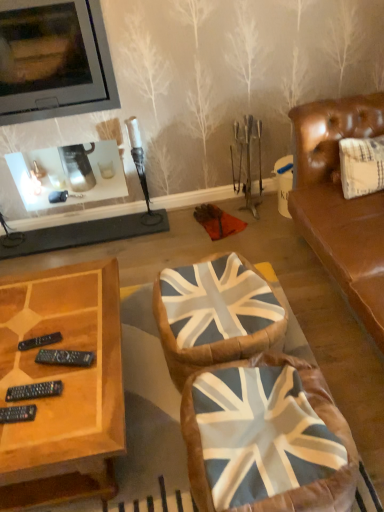
Measure the distance between union jack fabric swivel chair at center, which appears as the 2th swivel chair when viewed from the back, and camera.

The depth of union jack fabric swivel chair at center, which appears as the 2th swivel chair when viewed from the back, is 3.53 feet.

Describe the element at coordinates (54, 60) in the screenshot. I see `matte black television at upper left` at that location.

What are the coordinates of `union jack fabric swivel chair at center, which appears as the 2th swivel chair when viewed from the back` in the screenshot? It's located at (265, 438).

Which of these two, woodenwoodencoffee table at lower left or union jack fabric swivel chair at center, the second swivel chair when ordered from front to back, stands taller?

With more height is woodenwoodencoffee table at lower left.

Is woodenwoodencoffee table at lower left next to union jack fabric swivel chair at center, the 1th swivel chair when ordered from back to front, and touching it?

No, woodenwoodencoffee table at lower left is not with union jack fabric swivel chair at center, the 1th swivel chair when ordered from back to front.

Locate an element on the screen. This screenshot has height=512, width=384. coffee table that appears below the union jack fabric swivel chair at center, the second swivel chair when ordered from front to back (from the image's perspective) is located at coordinates (64, 386).

Is woodenwoodencoffee table at lower left smaller than union jack fabric swivel chair at center, the second swivel chair when ordered from front to back?

Actually, woodenwoodencoffee table at lower left might be larger than union jack fabric swivel chair at center, the second swivel chair when ordered from front to back.

From the image's perspective, is union jack fabric swivel chair at center, the 1th swivel chair when ordered from back to front, beneath union jack fabric swivel chair at center, the 1th swivel chair positioned from the front?

Incorrect, from the image's perspective, union jack fabric swivel chair at center, the 1th swivel chair when ordered from back to front, is higher than union jack fabric swivel chair at center, the 1th swivel chair positioned from the front.

Measure the distance between union jack fabric swivel chair at center, the second swivel chair when ordered from front to back, and union jack fabric swivel chair at center, which appears as the 2th swivel chair when viewed from the back.

union jack fabric swivel chair at center, the second swivel chair when ordered from front to back, is 9.74 inches away from union jack fabric swivel chair at center, which appears as the 2th swivel chair when viewed from the back.

Are union jack fabric swivel chair at center, the second swivel chair when ordered from front to back, and union jack fabric swivel chair at center, the 1th swivel chair positioned from the front, far apart?

No.

Considering the relative sizes of union jack fabric swivel chair at center, the second swivel chair when ordered from front to back, and matte black television at upper left in the image provided, is union jack fabric swivel chair at center, the second swivel chair when ordered from front to back, thinner than matte black television at upper left?

No.

Is union jack fabric swivel chair at center, the 1th swivel chair when ordered from back to front, directly adjacent to matte black television at upper left?

No, union jack fabric swivel chair at center, the 1th swivel chair when ordered from back to front, is not with matte black television at upper left.

Considering the relative sizes of union jack fabric swivel chair at center, the second swivel chair when ordered from front to back, and matte black television at upper left in the image provided, is union jack fabric swivel chair at center, the second swivel chair when ordered from front to back, bigger than matte black television at upper left?

Actually, union jack fabric swivel chair at center, the second swivel chair when ordered from front to back, might be smaller than matte black television at upper left.

From the image's perspective, is union jack fabric swivel chair at center, the second swivel chair when ordered from front to back, beneath matte black television at upper left?

Indeed, from the image's perspective, union jack fabric swivel chair at center, the second swivel chair when ordered from front to back, is shown beneath matte black television at upper left.

Which object is closer to the camera, woodenwoodencoffee table at lower left or union jack fabric swivel chair at center, which appears as the 2th swivel chair when viewed from the back?

union jack fabric swivel chair at center, which appears as the 2th swivel chair when viewed from the back.

Measure the distance from woodenwoodencoffee table at lower left to union jack fabric swivel chair at center, which appears as the 2th swivel chair when viewed from the back.

woodenwoodencoffee table at lower left and union jack fabric swivel chair at center, which appears as the 2th swivel chair when viewed from the back, are 17.87 inches apart from each other.

Is woodenwoodencoffee table at lower left to the left of union jack fabric swivel chair at center, which appears as the 2th swivel chair when viewed from the back, from the viewer's perspective?

Indeed, woodenwoodencoffee table at lower left is positioned on the left side of union jack fabric swivel chair at center, which appears as the 2th swivel chair when viewed from the back.

Considering the positions of points (88, 463) and (249, 389), is point (88, 463) farther from camera compared to point (249, 389)?

No, it is in front of (249, 389).

Considering the points (17, 47) and (319, 407), which point is in front, point (17, 47) or point (319, 407)?

The point (319, 407) is closer.

You are a GUI agent. You are given a task and a screenshot of the screen. Output one action in this format:
    pyautogui.click(x=<x>, y=<y>)
    Task: Click on the swivel chair that is the 2nd one when counting forward from the matte black television at upper left
    The width and height of the screenshot is (384, 512).
    Given the screenshot: What is the action you would take?
    pyautogui.click(x=265, y=438)

Who is more distant, matte black television at upper left or union jack fabric swivel chair at center, the 1th swivel chair positioned from the front?

Positioned behind is matte black television at upper left.

From a real-world perspective, between matte black television at upper left and union jack fabric swivel chair at center, the 1th swivel chair positioned from the front, who is vertically lower?

In real-world perspective, union jack fabric swivel chair at center, the 1th swivel chair positioned from the front, is lower.

Considering the sizes of union jack fabric swivel chair at center, the 1th swivel chair when ordered from back to front, and woodenwoodencoffee table at lower left in the image, is union jack fabric swivel chair at center, the 1th swivel chair when ordered from back to front, wider or thinner than woodenwoodencoffee table at lower left?

union jack fabric swivel chair at center, the 1th swivel chair when ordered from back to front, is thinner than woodenwoodencoffee table at lower left.

How distant is union jack fabric swivel chair at center, the second swivel chair when ordered from front to back, from woodenwoodencoffee table at lower left?

15.20 inches.

You are a GUI agent. You are given a task and a screenshot of the screen. Output one action in this format:
    pyautogui.click(x=<x>, y=<y>)
    Task: Click on the coffee table above the union jack fabric swivel chair at center, the second swivel chair when ordered from front to back (from a real-world perspective)
    
    Given the screenshot: What is the action you would take?
    pyautogui.click(x=64, y=386)

Does union jack fabric swivel chair at center, the second swivel chair when ordered from front to back, appear on the right side of woodenwoodencoffee table at lower left?

Correct, you'll find union jack fabric swivel chair at center, the second swivel chair when ordered from front to back, to the right of woodenwoodencoffee table at lower left.

Is union jack fabric swivel chair at center, which appears as the 2th swivel chair when viewed from the back, situated inside matte black television at upper left or outside?

union jack fabric swivel chair at center, which appears as the 2th swivel chair when viewed from the back, exists outside the volume of matte black television at upper left.

How far apart are union jack fabric swivel chair at center, the 1th swivel chair positioned from the front, and matte black television at upper left?

union jack fabric swivel chair at center, the 1th swivel chair positioned from the front, and matte black television at upper left are 5.86 feet apart.

Considering the sizes of objects union jack fabric swivel chair at center, which appears as the 2th swivel chair when viewed from the back, and matte black television at upper left in the image provided, who is thinner, union jack fabric swivel chair at center, which appears as the 2th swivel chair when viewed from the back, or matte black television at upper left?

With smaller width is matte black television at upper left.

From the image's perspective, does union jack fabric swivel chair at center, which appears as the 2th swivel chair when viewed from the back, appear higher than matte black television at upper left?

No.

You are a GUI agent. You are given a task and a screenshot of the screen. Output one action in this format:
    pyautogui.click(x=<x>, y=<y>)
    Task: Click on the coffee table below the union jack fabric swivel chair at center, the second swivel chair when ordered from front to back (from the image's perspective)
    This screenshot has width=384, height=512.
    Given the screenshot: What is the action you would take?
    pyautogui.click(x=64, y=386)

Identify the location of swivel chair located in front of the union jack fabric swivel chair at center, the 1th swivel chair when ordered from back to front. Image resolution: width=384 pixels, height=512 pixels. (265, 438).

Based on the photo, estimate the real-world distances between objects in this image. Which object is closer to union jack fabric swivel chair at center, the 1th swivel chair positioned from the front, matte black television at upper left or woodenwoodencoffee table at lower left?

woodenwoodencoffee table at lower left.

Considering their positions, is woodenwoodencoffee table at lower left positioned closer to matte black television at upper left than union jack fabric swivel chair at center, the 1th swivel chair when ordered from back to front?

The object closer to matte black television at upper left is woodenwoodencoffee table at lower left.

Which object lies further to the anchor point union jack fabric swivel chair at center, the 1th swivel chair when ordered from back to front, matte black television at upper left or union jack fabric swivel chair at center, which appears as the 2th swivel chair when viewed from the back?

Based on the image, matte black television at upper left appears to be further to union jack fabric swivel chair at center, the 1th swivel chair when ordered from back to front.

Looking at the image, which one is located closer to matte black television at upper left, union jack fabric swivel chair at center, which appears as the 2th swivel chair when viewed from the back, or woodenwoodencoffee table at lower left?

woodenwoodencoffee table at lower left.

Which object lies further to the anchor point union jack fabric swivel chair at center, the 1th swivel chair positioned from the front, woodenwoodencoffee table at lower left or matte black television at upper left?

matte black television at upper left.

Based on their spatial positions, is union jack fabric swivel chair at center, the 1th swivel chair when ordered from back to front, or woodenwoodencoffee table at lower left further from matte black television at upper left?

Based on the image, union jack fabric swivel chair at center, the 1th swivel chair when ordered from back to front, appears to be further to matte black television at upper left.

Which object lies further to the anchor point union jack fabric swivel chair at center, the second swivel chair when ordered from front to back, union jack fabric swivel chair at center, the 1th swivel chair positioned from the front, or woodenwoodencoffee table at lower left?

The object further to union jack fabric swivel chair at center, the second swivel chair when ordered from front to back, is woodenwoodencoffee table at lower left.

Based on their spatial positions, is union jack fabric swivel chair at center, the 1th swivel chair when ordered from back to front, or union jack fabric swivel chair at center, which appears as the 2th swivel chair when viewed from the back, further from matte black television at upper left?

Based on the image, union jack fabric swivel chair at center, which appears as the 2th swivel chair when viewed from the back, appears to be further to matte black television at upper left.

You are a GUI agent. You are given a task and a screenshot of the screen. Output one action in this format:
    pyautogui.click(x=<x>, y=<y>)
    Task: Click on the swivel chair between matte black television at upper left and union jack fabric swivel chair at center, the 1th swivel chair positioned from the front, in the vertical direction
    The image size is (384, 512).
    Given the screenshot: What is the action you would take?
    pyautogui.click(x=214, y=314)

Locate an element on the screen. coffee table between matte black television at upper left and union jack fabric swivel chair at center, which appears as the 2th swivel chair when viewed from the back, vertically is located at coordinates (64, 386).

You are a GUI agent. You are given a task and a screenshot of the screen. Output one action in this format:
    pyautogui.click(x=<x>, y=<y>)
    Task: Click on the swivel chair between woodenwoodencoffee table at lower left and union jack fabric swivel chair at center, which appears as the 2th swivel chair when viewed from the back, from left to right
    
    Given the screenshot: What is the action you would take?
    pyautogui.click(x=214, y=314)

The image size is (384, 512). Find the location of `swivel chair that lies between matte black television at upper left and woodenwoodencoffee table at lower left from top to bottom`. swivel chair that lies between matte black television at upper left and woodenwoodencoffee table at lower left from top to bottom is located at coordinates (214, 314).